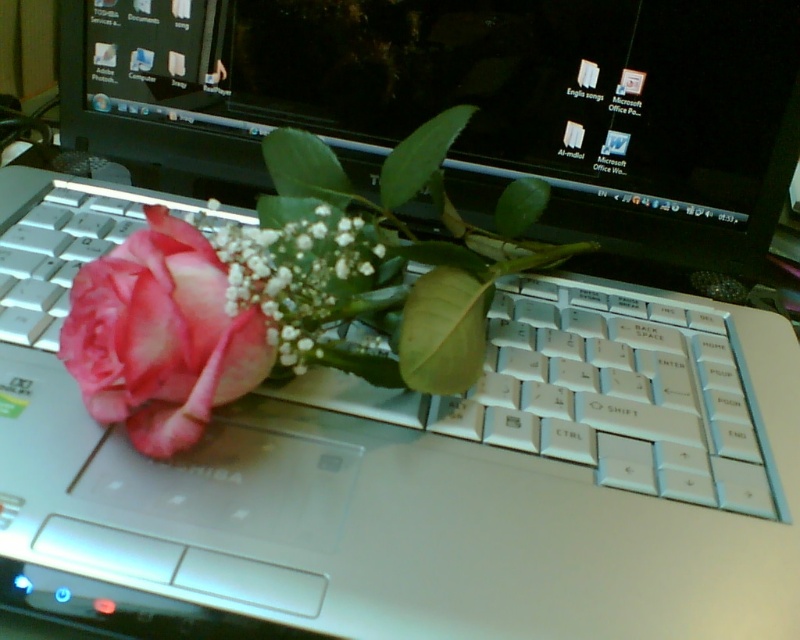
Question: Can you confirm if pink matte rose at center is wider than matte pink rose at left?

Choices:
 (A) yes
 (B) no

Answer: (A)

Question: Which object is positioned closest to the pink matte flower at center?

Choices:
 (A) matte pink rose at left
 (B) pink matte rose at center

Answer: (A)

Question: Which object is farther from the camera taking this photo?

Choices:
 (A) pink matte rose at center
 (B) pink matte flower at center

Answer: (A)

Question: Is pink matte rose at center to the right of pink matte flower at center from the viewer's perspective?

Choices:
 (A) no
 (B) yes

Answer: (B)

Question: Which object appears closest to the camera in this image?

Choices:
 (A) pink matte rose at center
 (B) pink matte flower at center
 (C) matte pink rose at left

Answer: (C)

Question: Does pink matte rose at center have a lesser width compared to matte pink rose at left?

Choices:
 (A) no
 (B) yes

Answer: (A)